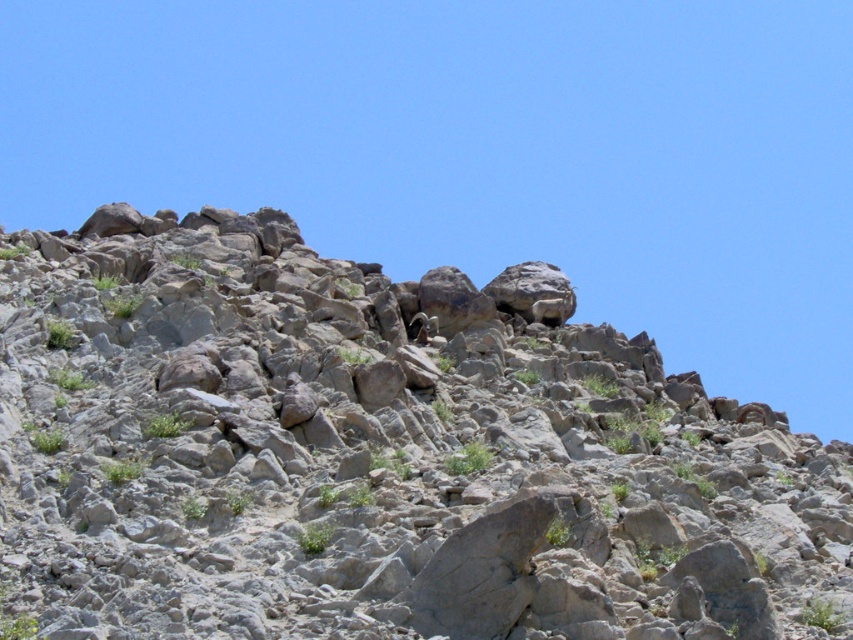
Question: Does gray rocky mountain at upper center appear over brown furry goat at center?

Choices:
 (A) yes
 (B) no

Answer: (B)

Question: Does gray rocky mountain at upper center come behind brown furry goat at center?

Choices:
 (A) yes
 (B) no

Answer: (B)

Question: Does gray rocky mountain at upper center have a greater width compared to brown furry goat at center?

Choices:
 (A) no
 (B) yes

Answer: (B)

Question: Which of the following is the closest to the observer?

Choices:
 (A) brown furry goat at center
 (B) gray rocky mountain at upper center

Answer: (B)

Question: Among these points, which one is nearest to the camera?

Choices:
 (A) (413, 339)
 (B) (195, 586)

Answer: (B)

Question: Which of the following is the closest to the observer?

Choices:
 (A) (787, 550)
 (B) (416, 324)

Answer: (A)